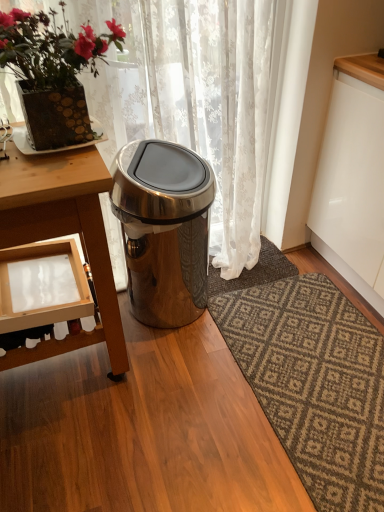
Find the location of a particular element. This screenshot has height=512, width=384. free space in front of satin silver trash can at center is located at coordinates (188, 374).